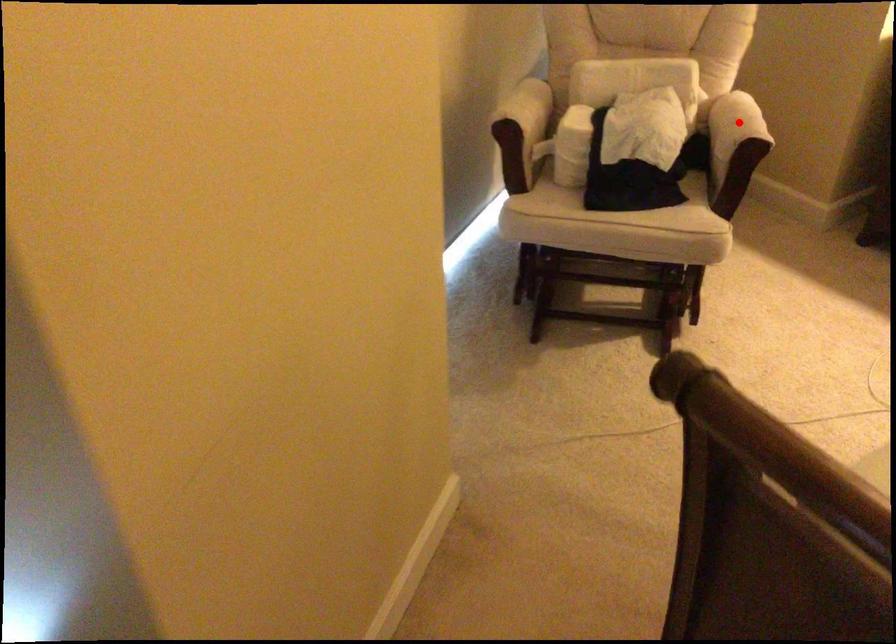
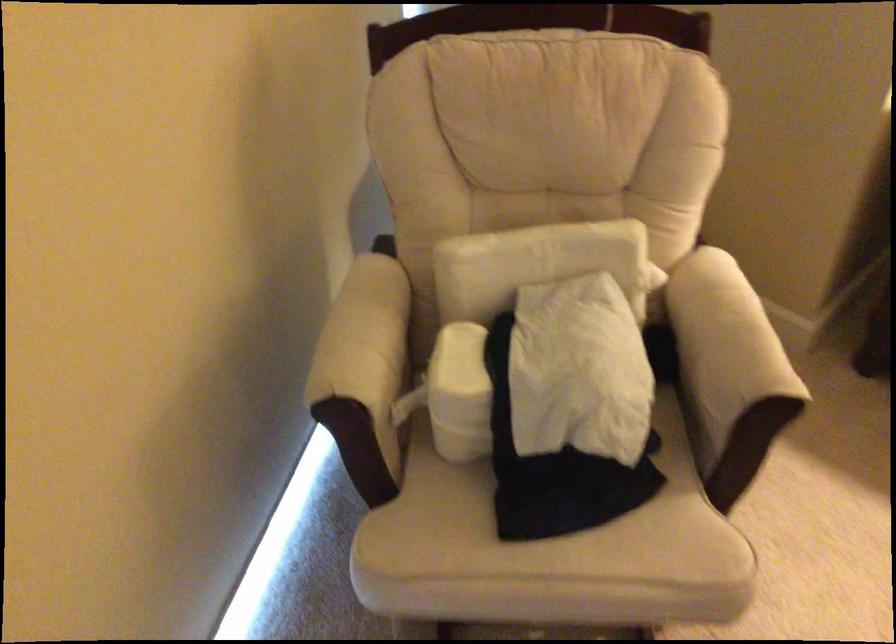
Question: I am providing you with two images of the same scene from different viewpoints. Given a red point in image1, look at the same physical point in image2. Is it:

Choices:
 (A) Closer to the viewpoint
 (B) Farther from the viewpoint

Answer: (A)